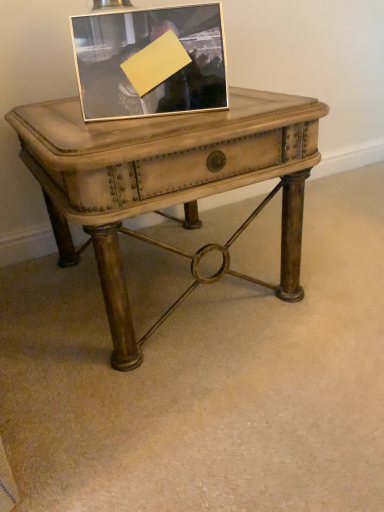
Question: From the image's perspective, relative to silver metallic picture frame at upper center, is matte wood table at center above or below?

Choices:
 (A) below
 (B) above

Answer: (A)

Question: Based on their sizes in the image, would you say matte wood table at center is bigger or smaller than silver metallic picture frame at upper center?

Choices:
 (A) big
 (B) small

Answer: (A)

Question: Based on their positions, is matte wood table at center located to the left or right of silver metallic picture frame at upper center?

Choices:
 (A) right
 (B) left

Answer: (A)

Question: From their relative heights in the image, would you say silver metallic picture frame at upper center is taller or shorter than matte wood table at center?

Choices:
 (A) short
 (B) tall

Answer: (A)

Question: In terms of width, does silver metallic picture frame at upper center look wider or thinner when compared to matte wood table at center?

Choices:
 (A) thin
 (B) wide

Answer: (A)

Question: From a real-world perspective, is silver metallic picture frame at upper center positioned above or below matte wood table at center?

Choices:
 (A) below
 (B) above

Answer: (B)

Question: Is silver metallic picture frame at upper center inside or outside of matte wood table at center?

Choices:
 (A) outside
 (B) inside

Answer: (A)